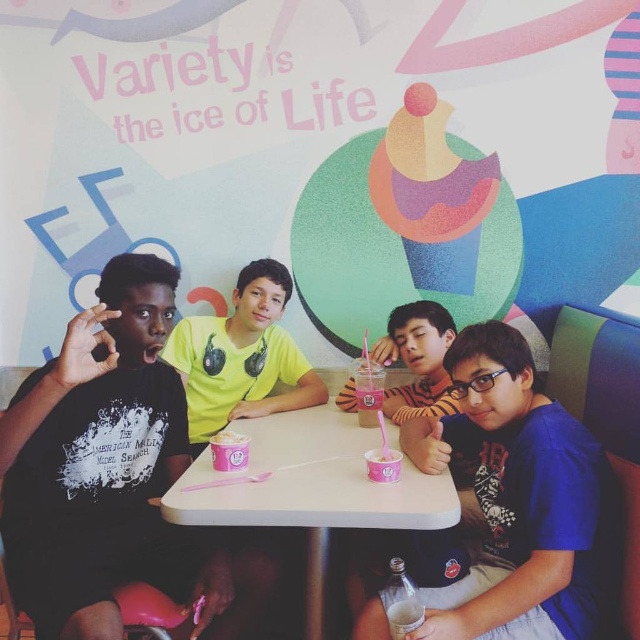
You are a customer at this casual dining establishment. You want to find the blue matte shirt at center. Where should you look?

You should look at point [518,500] to find the blue matte shirt at center.

You are a photographer trying to capture a group photo of the boys. You want to arrange them so that the blue matte shirt at center is positioned to the right of the yellow matte shirt at center. Based on the current arrangement in the image, is this already the case?

Yes, the blue matte shirt at center is already positioned to the right of the yellow matte shirt at center in the current arrangement.

You are standing at the entrance of the casual dining establishment. Where is the white plastic table at center located in relation to your current position?

The white plastic table at center is located at point 0.766 on the x axis and 0.487 on the y axis relative to your current position at the entrance.